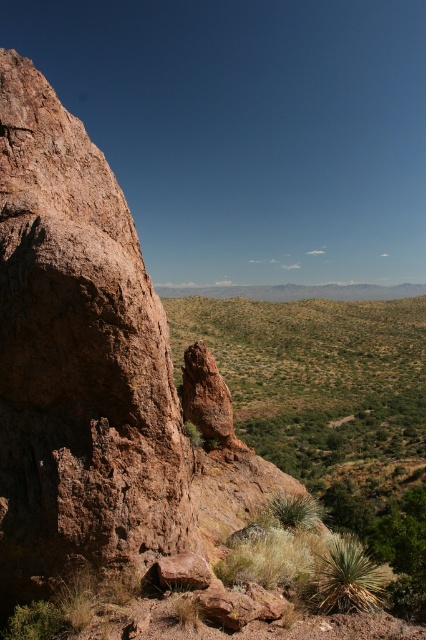
Between point (20, 195) and point (308, 371), which one is positioned in front?

Point (20, 195) is more forward.

Does brown rough rock at left have a larger size compared to green leafy shrubs at center?

No, brown rough rock at left is not bigger than green leafy shrubs at center.

Between point (120, 438) and point (189, 298), which one is positioned in front?

Positioned in front is point (120, 438).

Find the location of a particular element. The image size is (426, 640). brown rough rock at left is located at coordinates (77, 358).